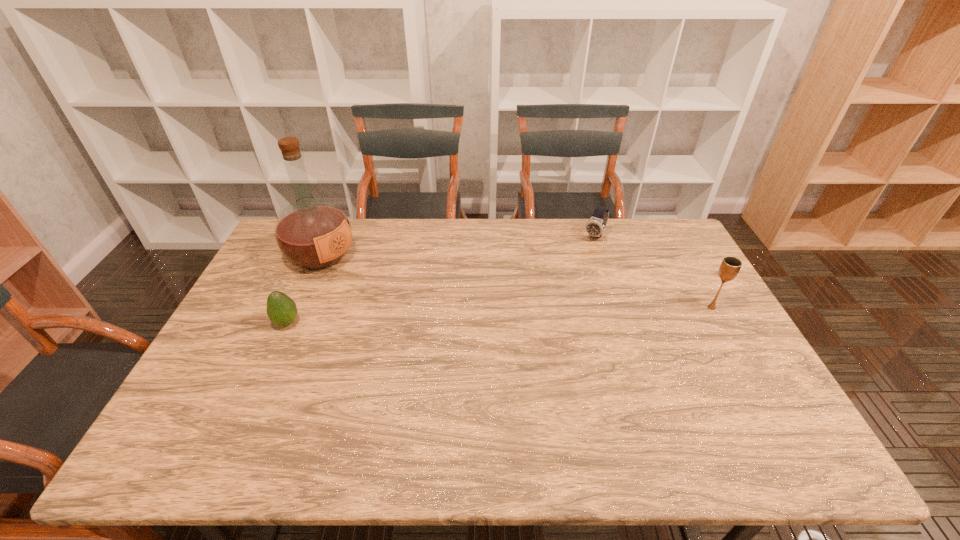
At what (x,y) coordinates should I click in order to perform the action: click on the nearest object. Please return your answer as a coordinate pair (x, y). Looking at the image, I should click on (281, 309).

Where is `the rightmost object`? The height and width of the screenshot is (540, 960). the rightmost object is located at coordinates (730, 266).

At what (x,y) coordinates should I click in order to perform the action: click on the second tallest object. Please return your answer as a coordinate pair (x, y). The height and width of the screenshot is (540, 960). Looking at the image, I should click on (730, 266).

Locate an element on the screen. This screenshot has height=540, width=960. liquor is located at coordinates (313, 233).

You are a GUI agent. You are given a task and a screenshot of the screen. Output one action in this format:
    pyautogui.click(x=<x>, y=<y>)
    Task: Click on the watch
    
    Given the screenshot: What is the action you would take?
    pyautogui.click(x=595, y=227)

Find the location of `vacant area situated on the right of the nearest object`. vacant area situated on the right of the nearest object is located at coordinates (373, 322).

This screenshot has height=540, width=960. What are the coordinates of `vacant space located on the front of the rightmost object` in the screenshot? It's located at 728,336.

Identify the location of vacant space located on the front label of the liquor. (440, 316).

At what (x,y) coordinates should I click in order to perform the action: click on blank space located on the front label of the liquor. Please return your answer as a coordinate pair (x, y). Looking at the image, I should click on (438, 315).

Where is `vacant position located 0.230m on the front label of the liquor`? The width and height of the screenshot is (960, 540). vacant position located 0.230m on the front label of the liquor is located at coordinates (398, 295).